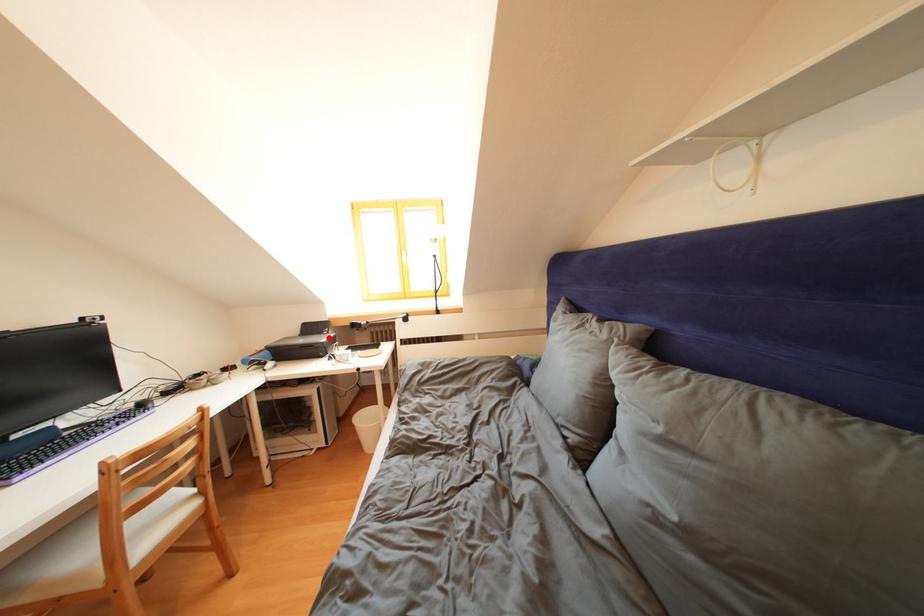
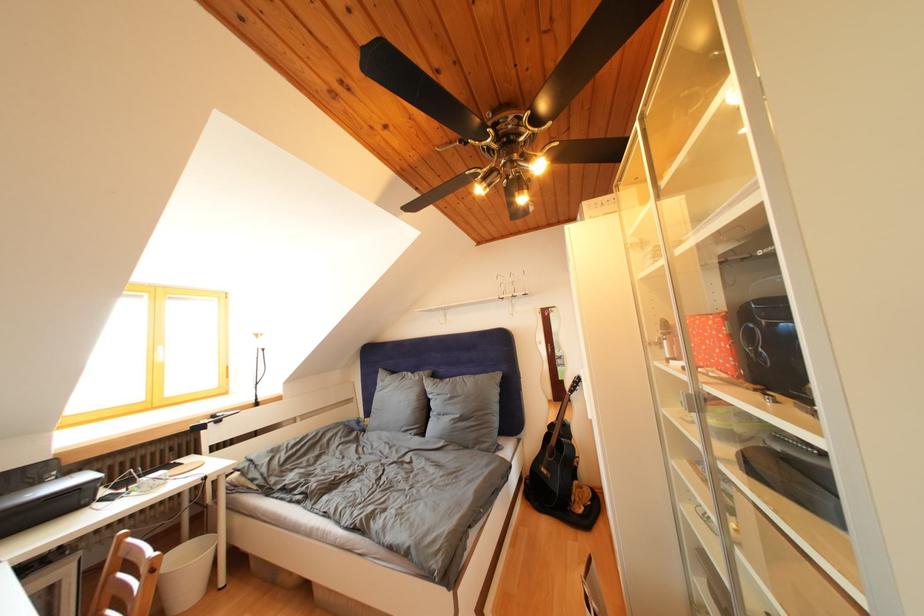
Question: A red point is marked in image1. In image2, is the corresponding 3D point closer to the camera or farther? Reply with the corresponding letter.

Choices:
 (A) The corresponding 3D point is closer.
 (B) The corresponding 3D point is farther.

Answer: (A)